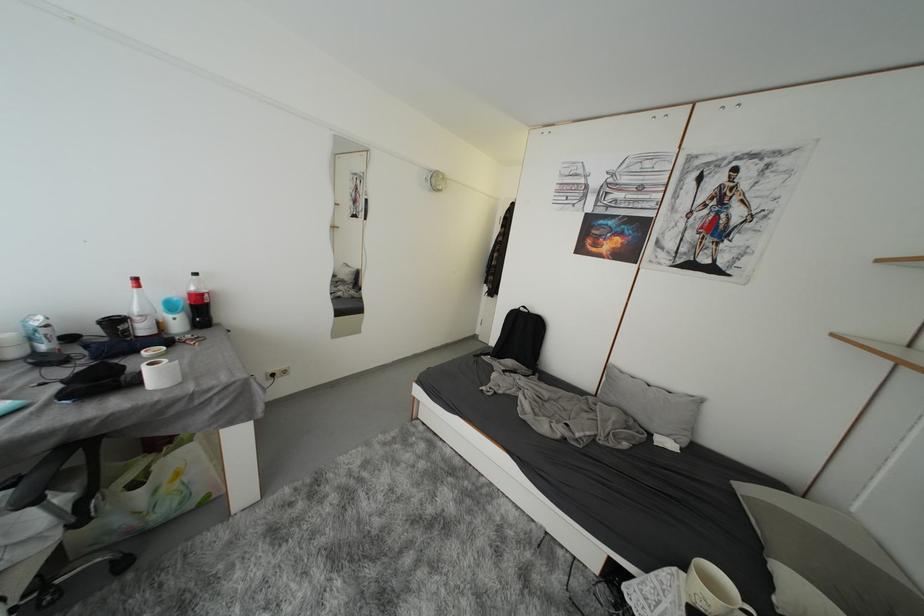
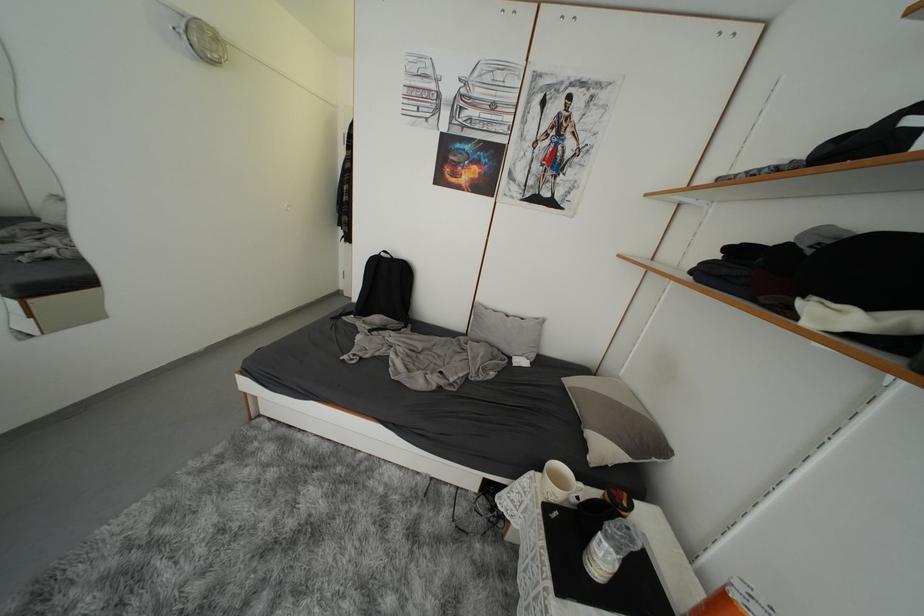
In the second image, find the point that corresponds to the point at 528,313 in the first image.

(390, 257)